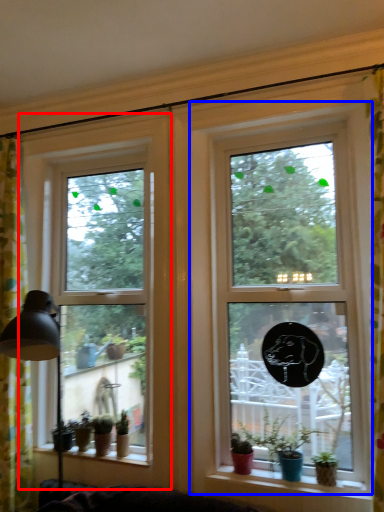
Question: Which point is closer to the camera, window (highlighted by a red box) or window (highlighted by a blue box)?

Choices:
 (A) window
 (B) window

Answer: (B)